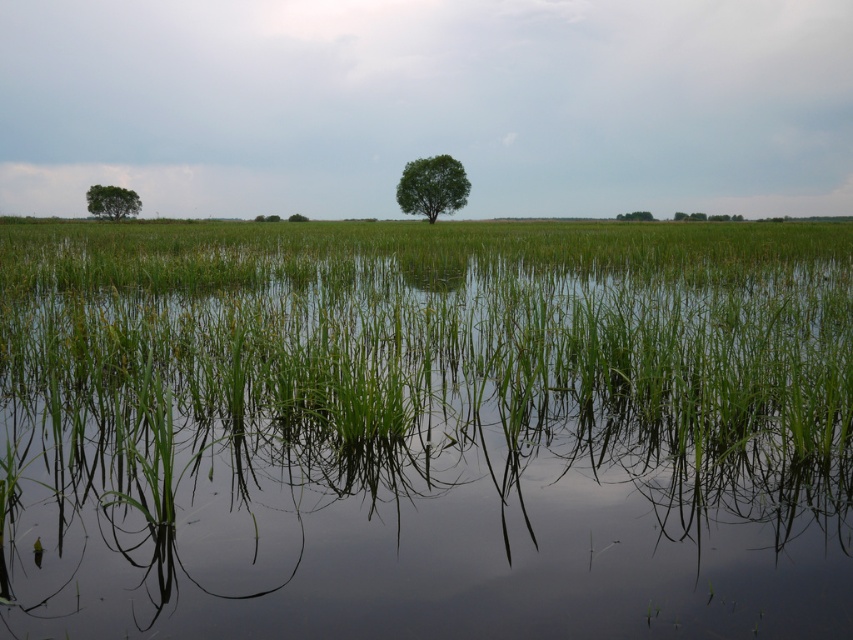
Question: Based on their relative distances, which object is farther from the green matte tree at center?

Choices:
 (A) green leafy tree at center
 (B) green leafy tree at upper right

Answer: (B)

Question: Among these objects, which one is farthest from the camera?

Choices:
 (A) green leafy tree at upper right
 (B) green leafy tree at center
 (C) green leafy tree at lower left
 (D) green matte tree at center

Answer: (A)

Question: Where is green leafy tree at upper right located in relation to green matte tree at center in the image?

Choices:
 (A) right
 (B) left

Answer: (A)

Question: Does green leafy tree at center have a greater width compared to green leafy tree at upper right?

Choices:
 (A) yes
 (B) no

Answer: (A)

Question: Estimate the real-world distances between objects in this image. Which object is closer to the green matte tree at center?

Choices:
 (A) green leafy tree at center
 (B) green leafy tree at lower left
 (C) green leafy tree at upper right

Answer: (A)

Question: Is green leafy tree at center further to camera compared to green leafy tree at lower left?

Choices:
 (A) yes
 (B) no

Answer: (B)